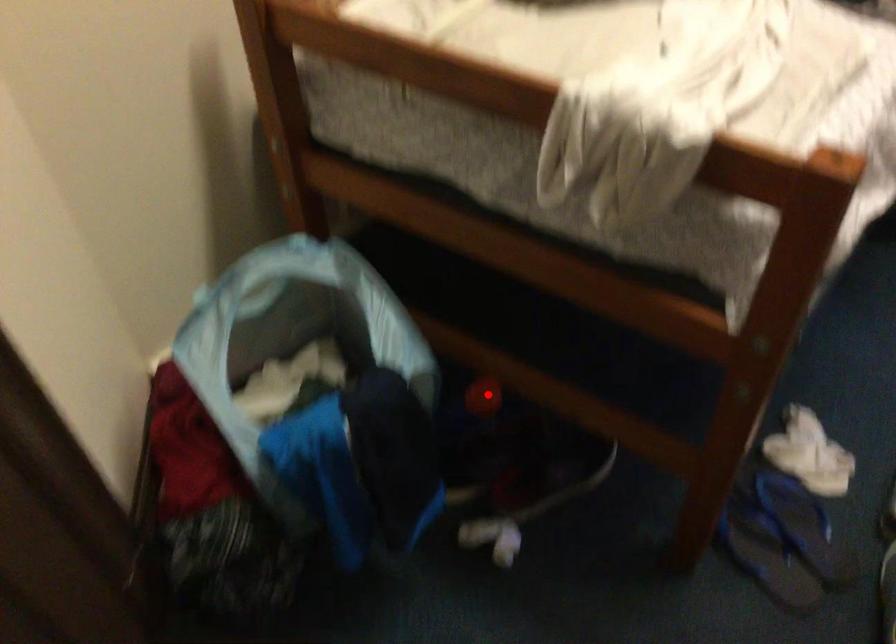
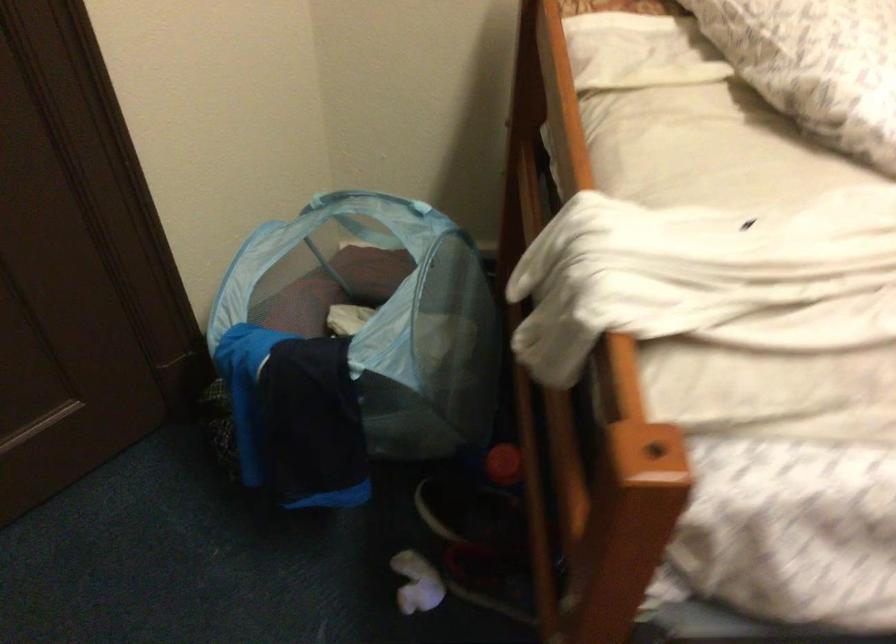
Question: I am providing you with two images of the same scene from different viewpoints. Given a red point in image1, look at the same physical point in image2. Is it:

Choices:
 (A) Closer to the viewpoint
 (B) Farther from the viewpoint

Answer: (A)